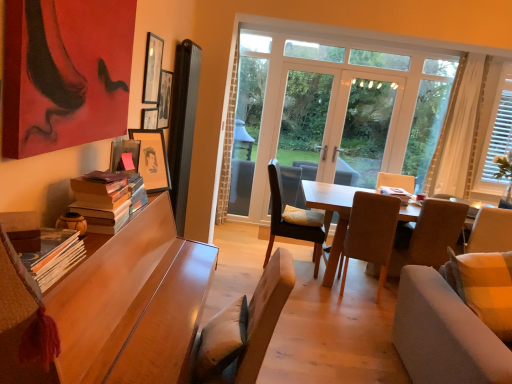
What do you see at coordinates (164, 99) in the screenshot? I see `wooden picture frame at upper center, marked as the second picture frame in a bottom-to-top arrangement` at bounding box center [164, 99].

Where is `soft beige fabric couch at lower right`? soft beige fabric couch at lower right is located at coordinates (455, 321).

Measure the distance between point (261, 361) and camera.

Point (261, 361) is 1.64 meters from camera.

At what (x,y) coordinates should I click in order to perform the action: click on light brown fabric chair at lower center, which is the 4th chair from right to left. Please return your answer as a coordinate pair (x, y). The image size is (512, 384). Looking at the image, I should click on coord(246,326).

This screenshot has width=512, height=384. I want to click on wooden desk at left, so click(125, 308).

The width and height of the screenshot is (512, 384). What are the coordinates of `transparent glass door at center` in the screenshot? It's located at (302, 131).

From the picture: From the image's perspective, is light brown wooden table at center below white wooden blinds at right, positioned as the first window in right-to-left order?

Yes, from the image's perspective, light brown wooden table at center is beneath white wooden blinds at right, positioned as the first window in right-to-left order.

Does light brown wooden table at center have a greater height compared to white wooden blinds at right, positioned as the first window in right-to-left order?

No, light brown wooden table at center is not taller than white wooden blinds at right, positioned as the first window in right-to-left order.

Find the location of a particular element. The width and height of the screenshot is (512, 384). window that is the 1st one when counting backward from the light brown wooden table at center is located at coordinates (493, 128).

Between point (331, 268) and point (483, 143), which one is positioned behind?

Positioned behind is point (483, 143).

In the scene shown: Is dark brown leather chair at center, which is counted as the fourth chair, starting from the front, oriented away from soft beige fabric couch at lower right?

dark brown leather chair at center, which is counted as the fourth chair, starting from the front, does not have its back to soft beige fabric couch at lower right.

Looking at this image, is dark brown leather chair at center, which is counted as the fourth chair, starting from the front, positioned beyond the bounds of soft beige fabric couch at lower right?

Yes, dark brown leather chair at center, which is counted as the fourth chair, starting from the front, is located beyond the bounds of soft beige fabric couch at lower right.

From the image's perspective, which object appears higher, dark brown leather chair at center, which appears as the 2th chair when viewed from the left, or soft beige fabric couch at lower right?

dark brown leather chair at center, which appears as the 2th chair when viewed from the left, is shown above in the image.

Which is more to the right, wooden picture frame at upper center, placed as the first picture frame when sorted from back to front, or wooden picture frame at upper left, placed as the first picture frame when sorted from front to back?

From the viewer's perspective, wooden picture frame at upper left, placed as the first picture frame when sorted from front to back, appears more on the right side.

From the picture: Is wooden picture frame at upper center, placed as the second picture frame when sorted from top to bottom, completely or partially outside of wooden picture frame at upper left, placed as the first picture frame when sorted from front to back?

Yes, wooden picture frame at upper center, placed as the second picture frame when sorted from top to bottom, is not within wooden picture frame at upper left, placed as the first picture frame when sorted from front to back.

Is wooden picture frame at upper center, placed as the second picture frame when sorted from top to bottom, looking in the opposite direction of wooden picture frame at upper left, which ranks as the first picture frame in bottom-to-top order?

wooden picture frame at upper center, placed as the second picture frame when sorted from top to bottom, does not have its back to wooden picture frame at upper left, which ranks as the first picture frame in bottom-to-top order.

From the picture: In the image, is wooden picture frame at upper center, placed as the first picture frame when sorted from back to front, positioned in front of or behind wooden picture frame at upper left, which appears as the 3th picture frame when viewed from the top?

Visually, wooden picture frame at upper center, placed as the first picture frame when sorted from back to front, is located behind wooden picture frame at upper left, which appears as the 3th picture frame when viewed from the top.

Based on the photo, between matte black picture frame at upper left, positioned as the 3th picture frame in bottom-to-top order, and hardcover books at left, the third book in the back-to-front sequence, which one is positioned behind?

matte black picture frame at upper left, positioned as the 3th picture frame in bottom-to-top order.

Which of these two, matte black picture frame at upper left, positioned as the 3th picture frame in bottom-to-top order, or hardcover books at left, the third book in the back-to-front sequence, stands shorter?

Standing shorter between the two is hardcover books at left, the third book in the back-to-front sequence.

Is matte black picture frame at upper left, the second picture frame from the back, turned away from hardcover books at left, the 1th book from the left?

matte black picture frame at upper left, the second picture frame from the back, is not turned away from hardcover books at left, the 1th book from the left.

Considering the positions of points (149, 41) and (29, 259), is point (149, 41) farther from camera compared to point (29, 259)?

Yes, point (149, 41) is farther from viewer.

Which is more to the right, soft beige fabric couch at lower right or dark brown leather chair at center, the first chair in the back-to-front sequence?

Positioned to the right is soft beige fabric couch at lower right.

Considering the sizes of soft beige fabric couch at lower right and dark brown leather chair at center, placed as the 3th chair when sorted from right to left, in the image, is soft beige fabric couch at lower right wider or thinner than dark brown leather chair at center, placed as the 3th chair when sorted from right to left,?

soft beige fabric couch at lower right is wider than dark brown leather chair at center, placed as the 3th chair when sorted from right to left.

Can you confirm if soft beige fabric couch at lower right is smaller than dark brown leather chair at center, which is counted as the fourth chair, starting from the front?

No.

What's the angular difference between soft beige fabric couch at lower right and dark brown leather chair at center, which appears as the 2th chair when viewed from the left,'s facing directions?

84.9 degrees separate the facing orientations of soft beige fabric couch at lower right and dark brown leather chair at center, which appears as the 2th chair when viewed from the left.

Does point (327, 188) lie behind point (134, 166)?

Yes.

Is light brown wooden table at center far away from wooden picture frame at upper left, marked as the third picture frame in a back-to-front arrangement?

That's right, there is a large distance between light brown wooden table at center and wooden picture frame at upper left, marked as the third picture frame in a back-to-front arrangement.

Is light brown wooden table at center taller than wooden picture frame at upper left, placed as the first picture frame when sorted from front to back?

Yes, light brown wooden table at center is taller than wooden picture frame at upper left, placed as the first picture frame when sorted from front to back.

At what (x,y) coordinates should I click in order to perform the action: click on studio couch that is under the brown fabric chair at center, which ranks as the 3th chair in back-to-front order (from a real-world perspective). Please return your answer as a coordinate pair (x, y). The height and width of the screenshot is (384, 512). Looking at the image, I should click on (455, 321).

How far apart are brown fabric chair at center, marked as the second chair in a right-to-left arrangement, and soft beige fabric couch at lower right?

brown fabric chair at center, marked as the second chair in a right-to-left arrangement, and soft beige fabric couch at lower right are 39.33 inches apart from each other.

Starting from the light brown wooden table at center, which window is the 1st one behind? Please provide its 2D coordinates.

[(493, 128)]

From the image's perspective, which chair is the 4th one above the soft beige fabric couch at lower right? Please provide its 2D coordinates.

[(288, 223)]

When comparing their distances from dark brown leather chair at center, placed as the 3th chair when sorted from right to left, does brown fabric chair at center, marked as the second chair in a right-to-left arrangement, or wooden picture frame at upper left, placed as the first picture frame when sorted from front to back, seem further?

wooden picture frame at upper left, placed as the first picture frame when sorted from front to back.

When comparing their distances from brown fabric chair at center, which is the third chair from left to right, does hardcover books at left, the second book when ordered from left to right, or wooden desk at left seem closer?

The object closer to brown fabric chair at center, which is the third chair from left to right, is wooden desk at left.

Considering their positions, is transparent glass window at center, the second window positioned from the right, positioned closer to wooden picture frame at upper left, marked as the third picture frame in a back-to-front arrangement, than light brown fabric chair at lower center, which is the 4th chair from right to left?

The object closer to wooden picture frame at upper left, marked as the third picture frame in a back-to-front arrangement, is light brown fabric chair at lower center, which is the 4th chair from right to left.

Considering their positions, is light brown wooden table at center positioned closer to hardcover books at left, the 2th book viewed from the front, than wooden picture frame at upper left, which ranks as the first picture frame in bottom-to-top order?

wooden picture frame at upper left, which ranks as the first picture frame in bottom-to-top order, is positioned closer to the anchor hardcover books at left, the 2th book viewed from the front.

Considering their positions, is brown fabric chair at center, marked as the second chair in a right-to-left arrangement, positioned closer to yellow fabric pillow at center than hardcover books at left, the second book when ordered from left to right?

The object closer to yellow fabric pillow at center is brown fabric chair at center, marked as the second chair in a right-to-left arrangement.

Considering their positions, is white sheer curtain at right positioned closer to hardcover books at left, the second book when ordered from left to right, than yellow fabric pillow at center?

Based on the image, yellow fabric pillow at center appears to be nearer to hardcover books at left, the second book when ordered from left to right.

Estimate the real-world distances between objects in this image. Which object is further from wooden picture frame at upper left, marked as the third picture frame in a back-to-front arrangement, transparent glass door at center or yellow fabric pillow at center?

transparent glass door at center lies further to wooden picture frame at upper left, marked as the third picture frame in a back-to-front arrangement, than the other object.

From the image, which object appears to be nearer to wooden picture frame at upper left, placed as the first picture frame when sorted from front to back, light brown wooden table at center or wooden desk at left?

wooden desk at left is positioned closer to the anchor wooden picture frame at upper left, placed as the first picture frame when sorted from front to back.

The height and width of the screenshot is (384, 512). I want to click on pillow positioned between hardcover books at left, positioned as the third book in right-to-left order, and transparent glass window at center, the second window positioned from the right, from near to far, so (x=303, y=216).

You are a GUI agent. You are given a task and a screenshot of the screen. Output one action in this format:
    pyautogui.click(x=<x>, y=<y>)
    Task: Click on the curtain situated between yellow fabric pillow at center and white wooden blinds at right, which is the 2th window from left to right, from left to right
    
    Given the screenshot: What is the action you would take?
    pyautogui.click(x=459, y=130)

Where is `pillow between hardcover books at left, the second book when ordered from left to right, and transparent glass window at center, which appears as the first window when viewed from the left, from front to back`? This screenshot has height=384, width=512. pillow between hardcover books at left, the second book when ordered from left to right, and transparent glass window at center, which appears as the first window when viewed from the left, from front to back is located at coordinates (303, 216).

This screenshot has width=512, height=384. Find the location of `book between yellow fabric pillow at center and light brown wooden table at center from left to right`. book between yellow fabric pillow at center and light brown wooden table at center from left to right is located at coordinates (396, 193).